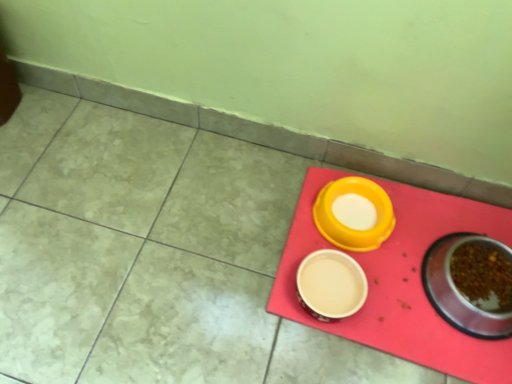
Identify the location of unoccupied space behind metallic stainless steel bowl at lower right, which is counted as the first tableware, starting from the right. pos(445,221).